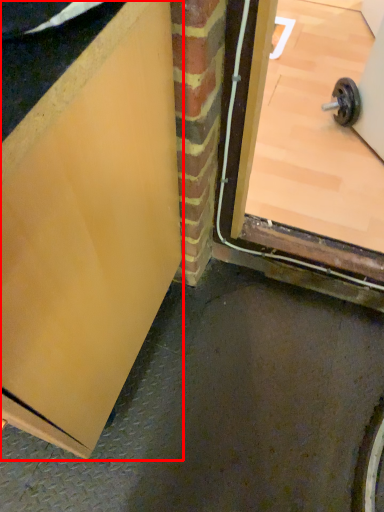
Question: From the image's perspective, what is the correct spatial relationship of door (annotated by the red box) in relation to door?

Choices:
 (A) below
 (B) above

Answer: (A)